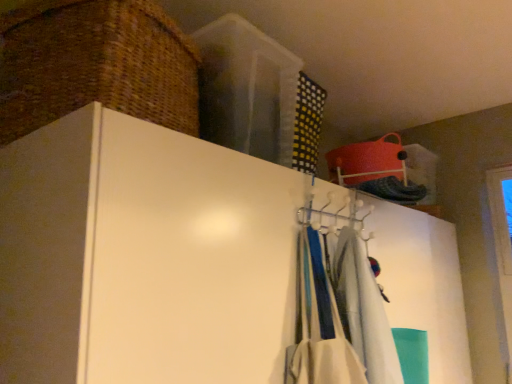
Question: Can you confirm if white fabric scarf at center is smaller than woven brown basket at upper left?

Choices:
 (A) yes
 (B) no

Answer: (A)

Question: Does white fabric scarf at center appear on the right side of woven brown basket at upper left?

Choices:
 (A) yes
 (B) no

Answer: (A)

Question: Is white fabric scarf at center thinner than woven brown basket at upper left?

Choices:
 (A) no
 (B) yes

Answer: (B)

Question: Is white fabric scarf at center facing away from woven brown basket at upper left?

Choices:
 (A) yes
 (B) no

Answer: (B)

Question: From the image's perspective, is white fabric scarf at center located above woven brown basket at upper left?

Choices:
 (A) yes
 (B) no

Answer: (B)

Question: Visually, is white matte cupboard at upper center positioned to the left or to the right of woven brown basket at upper left?

Choices:
 (A) right
 (B) left

Answer: (A)

Question: Does point (33, 329) appear closer or farther from the camera than point (123, 81)?

Choices:
 (A) closer
 (B) farther

Answer: (A)

Question: From the image's perspective, is white matte cupboard at upper center above or below woven brown basket at upper left?

Choices:
 (A) above
 (B) below

Answer: (B)

Question: Considering the positions of white matte cupboard at upper center and woven brown basket at upper left in the image, is white matte cupboard at upper center taller or shorter than woven brown basket at upper left?

Choices:
 (A) short
 (B) tall

Answer: (B)

Question: Considering the relative positions of woven brown basket at upper left and white matte cupboard at upper center in the image provided, is woven brown basket at upper left to the left or to the right of white matte cupboard at upper center?

Choices:
 (A) left
 (B) right

Answer: (A)

Question: In terms of size, does woven brown basket at upper left appear bigger or smaller than white matte cupboard at upper center?

Choices:
 (A) small
 (B) big

Answer: (A)

Question: Looking at their shapes, would you say woven brown basket at upper left is wider or thinner than white matte cupboard at upper center?

Choices:
 (A) thin
 (B) wide

Answer: (A)

Question: Which is correct: woven brown basket at upper left is inside white matte cupboard at upper center, or outside of it?

Choices:
 (A) outside
 (B) inside

Answer: (A)

Question: Would you say woven brown basket at upper left is to the left or to the right of white fabric scarf at center in the picture?

Choices:
 (A) right
 (B) left

Answer: (B)

Question: Considering the positions of point (196, 122) and point (372, 344), is point (196, 122) closer or farther from the camera than point (372, 344)?

Choices:
 (A) closer
 (B) farther

Answer: (B)